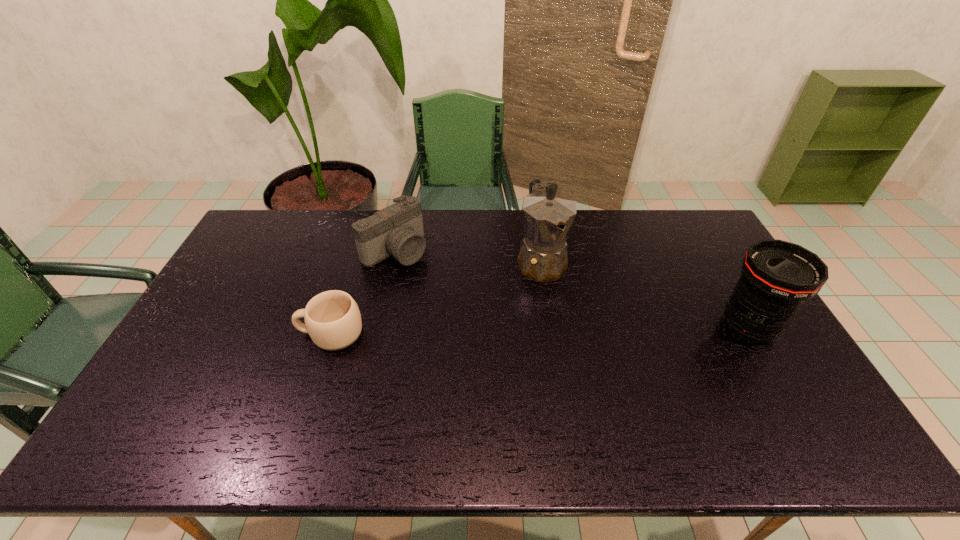
You are a GUI agent. You are given a task and a screenshot of the screen. Output one action in this format:
    pyautogui.click(x=<x>, y=<y>)
    Task: Click on the shortest object
    
    Given the screenshot: What is the action you would take?
    pyautogui.click(x=332, y=318)

Image resolution: width=960 pixels, height=540 pixels. What are the coordinates of `telephoto lens` in the screenshot? It's located at (777, 277).

You are a GUI agent. You are given a task and a screenshot of the screen. Output one action in this format:
    pyautogui.click(x=<x>, y=<y>)
    Task: Click on the rightmost object
    
    Given the screenshot: What is the action you would take?
    pyautogui.click(x=777, y=277)

Locate an element on the screen. The height and width of the screenshot is (540, 960). the third object from left to right is located at coordinates (548, 215).

Identify the location of coffeepot. This screenshot has width=960, height=540. (548, 215).

You are a GUI agent. You are given a task and a screenshot of the screen. Output one action in this format:
    pyautogui.click(x=<x>, y=<y>)
    Task: Click on the camera
    Image resolution: width=960 pixels, height=540 pixels.
    Given the screenshot: What is the action you would take?
    pyautogui.click(x=397, y=230)

You are a GUI agent. You are given a task and a screenshot of the screen. Output one action in this format:
    pyautogui.click(x=<x>, y=<y>)
    Task: Click on the vacant space situated on the side of the shortest object with the handle
    This screenshot has height=540, width=960.
    Given the screenshot: What is the action you would take?
    pyautogui.click(x=253, y=334)

The width and height of the screenshot is (960, 540). Find the location of `vacant position located 0.130m on the side of the shortest object with the handle`. vacant position located 0.130m on the side of the shortest object with the handle is located at coordinates (253, 334).

Where is `blank area located on the side of the shortest object with the handle`? The width and height of the screenshot is (960, 540). blank area located on the side of the shortest object with the handle is located at coordinates (215, 334).

The height and width of the screenshot is (540, 960). In order to click on vacant point located 0.160m on the back of the third shortest object in this screenshot , I will do click(715, 269).